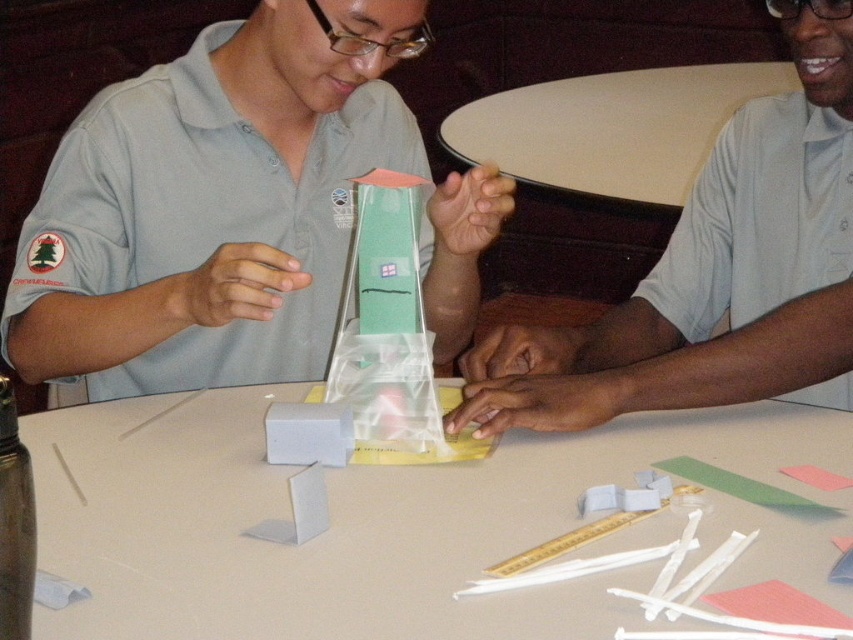
Does matte plastic tower at center have a smaller size compared to white glossy table at upper center?

Indeed, matte plastic tower at center has a smaller size compared to white glossy table at upper center.

Between point (247, 128) and point (666, 192), which one is positioned behind?

Positioned behind is point (666, 192).

At what (x,y) coordinates should I click in order to perform the action: click on matte plastic tower at center. Please return your answer as a coordinate pair (x, y). Looking at the image, I should click on (212, 204).

Where is `white paper at center`? The image size is (853, 640). white paper at center is located at coordinates (350, 522).

Locate an element on the screen. white paper at center is located at coordinates point(350,522).

Is white glossy table at upper center below transparent plastic tower at center?

No, white glossy table at upper center is not below transparent plastic tower at center.

Is point (708, 144) less distant than point (398, 397)?

No, it is behind (398, 397).

Locate an element on the screen. The image size is (853, 640). white glossy table at upper center is located at coordinates (611, 129).